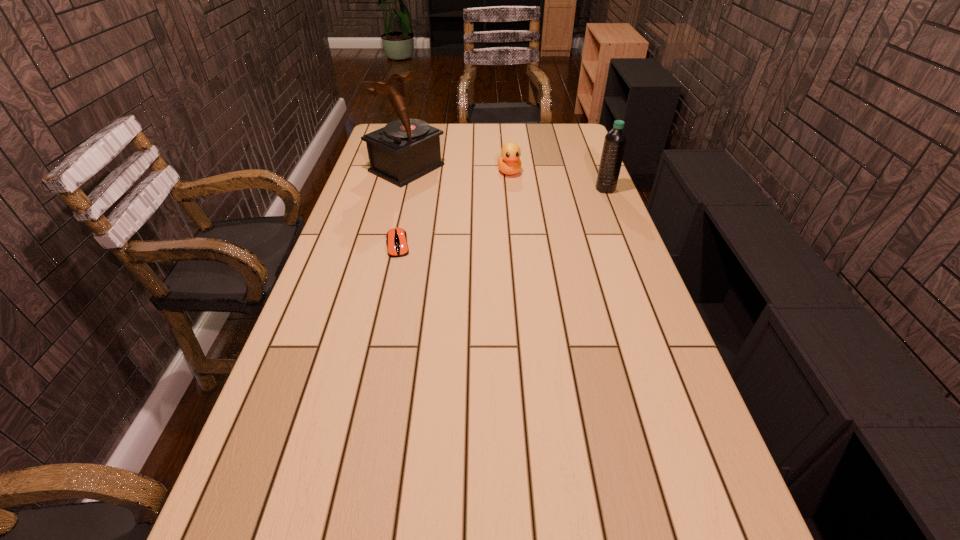
Identify the location of vacant space on the desktop that is between the computer mouse and the rightmost object and is positioned on the face of the third object from left to right. The image size is (960, 540). (523, 211).

Where is `vacant space on the desktop that is between the computer mouse and the water bottle and is positioned at the horn opening of the phonograph_record`? Image resolution: width=960 pixels, height=540 pixels. vacant space on the desktop that is between the computer mouse and the water bottle and is positioned at the horn opening of the phonograph_record is located at coordinates (509, 215).